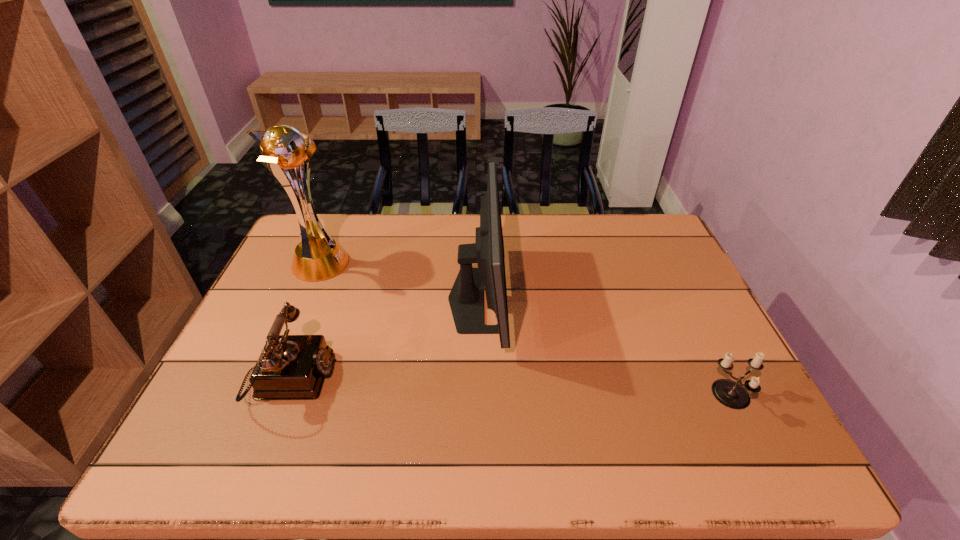
Where is `trophy`? The height and width of the screenshot is (540, 960). trophy is located at coordinates (320, 257).

This screenshot has height=540, width=960. I want to click on the third shortest object, so (x=466, y=298).

Find the location of a particular element. The width and height of the screenshot is (960, 540). the second object from right to left is located at coordinates (466, 298).

You are a GUI agent. You are given a task and a screenshot of the screen. Output one action in this format:
    pyautogui.click(x=<x>, y=<y>)
    Task: Click on the second shortest object
    The image size is (960, 540).
    Given the screenshot: What is the action you would take?
    pyautogui.click(x=291, y=367)

The width and height of the screenshot is (960, 540). In order to click on the shortest object in this screenshot , I will do `click(731, 394)`.

Where is `candle holder`? The height and width of the screenshot is (540, 960). candle holder is located at coordinates (731, 394).

I want to click on free spot located 0.240m on the front-facing side of the trophy, so click(x=425, y=264).

Image resolution: width=960 pixels, height=540 pixels. Find the location of `vacant space located 0.100m on the screen side of the third shortest object`. vacant space located 0.100m on the screen side of the third shortest object is located at coordinates [541, 299].

I want to click on free location located on the dial of the second shortest object, so click(365, 379).

Identify the location of free location located 0.300m on the left of the rightmost object. (580, 396).